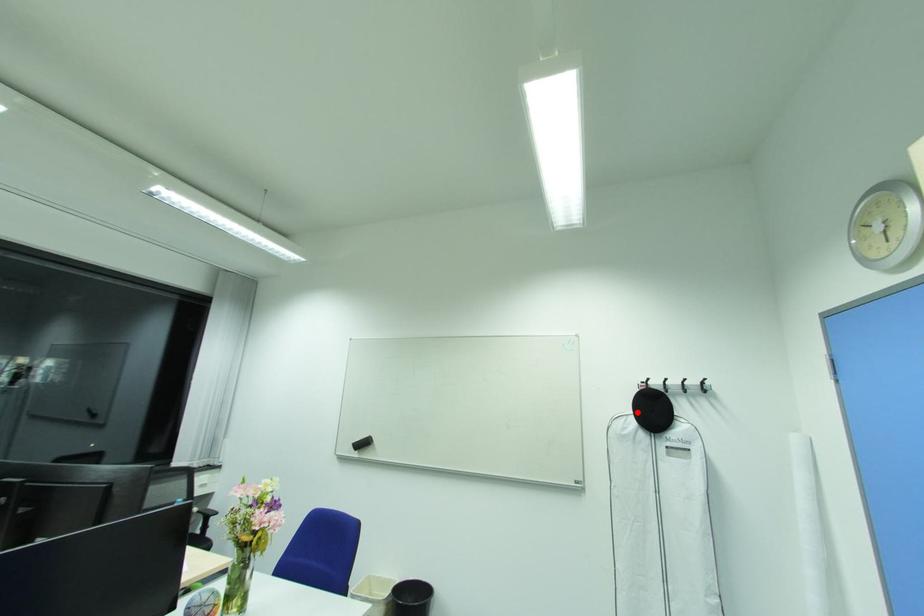
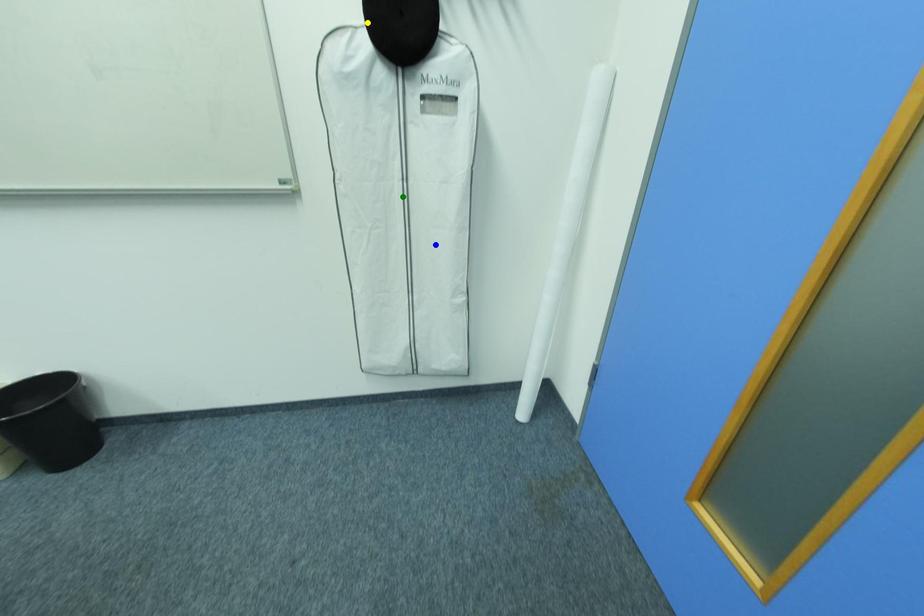
Question: I am providing you with two images of the same scene from different viewpoints. A red point is marked on the first image. You are given multiple points on the second image. Which spot in image 2 lines up with the point in image 1?

Choices:
 (A) blue point
 (B) yellow point
 (C) green point

Answer: (B)